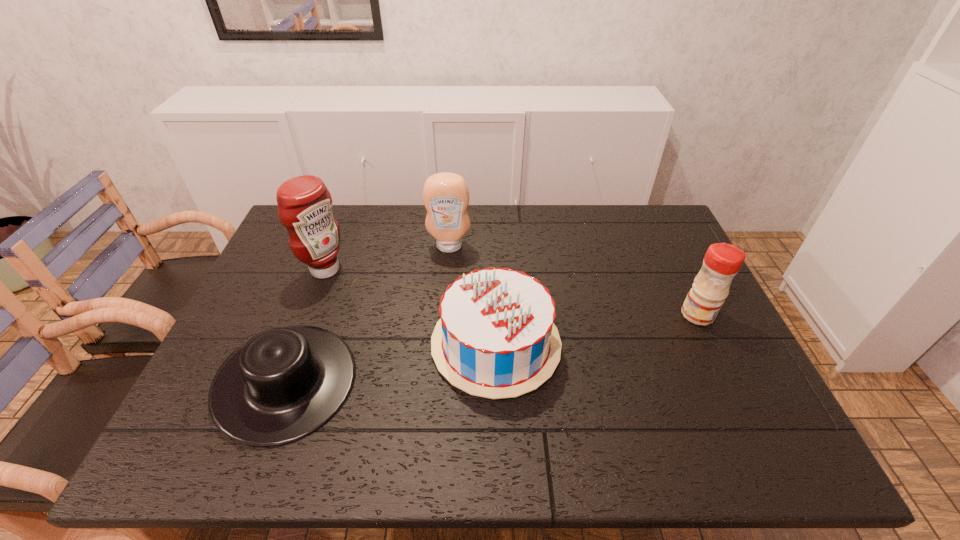
Locate an element on the screen. The height and width of the screenshot is (540, 960). object that stands as the second closest to the second condiment from right to left is located at coordinates (305, 204).

Identify which condiment is located as the nearest to the leftmost condiment. Please provide its 2D coordinates. Your answer should be formatted as a tuple, i.e. [(x, y)], where the tuple contains the x and y coordinates of a point satisfying the conditions above.

[(446, 196)]

Point out which condiment is positioned as the second nearest to the shortest object. Please provide its 2D coordinates. Your answer should be formatted as a tuple, i.e. [(x, y)], where the tuple contains the x and y coordinates of a point satisfying the conditions above.

[(446, 196)]

I want to click on vacant space that satisfies the following two spatial constraints: 1. on the label of the farthest condiment; 2. on the right side of the rightmost condiment, so click(x=444, y=314).

Where is `blank area in the image that satisfies the following two spatial constraints: 1. on the front side of the second nearest condiment; 2. on the left side of the rightmost condiment`? blank area in the image that satisfies the following two spatial constraints: 1. on the front side of the second nearest condiment; 2. on the left side of the rightmost condiment is located at coordinates (308, 314).